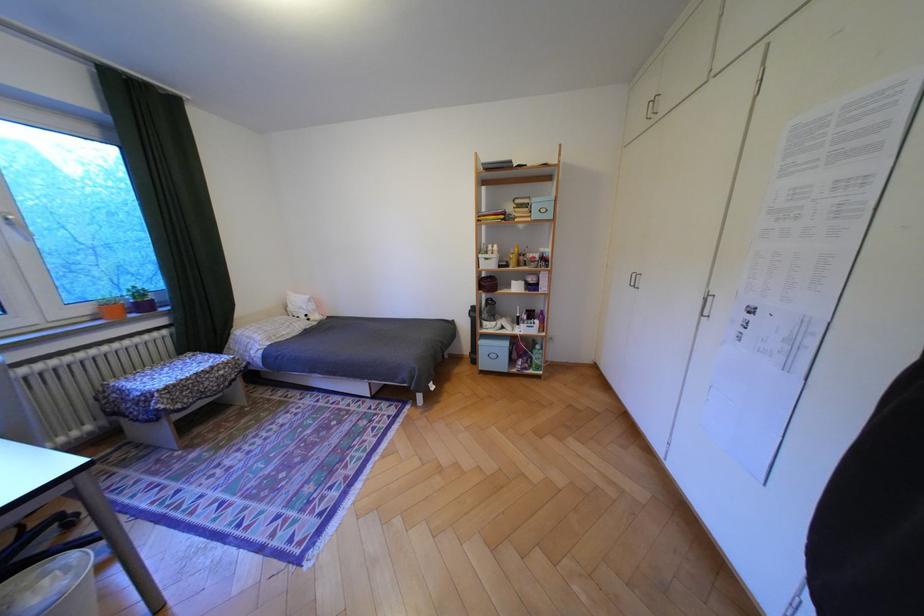
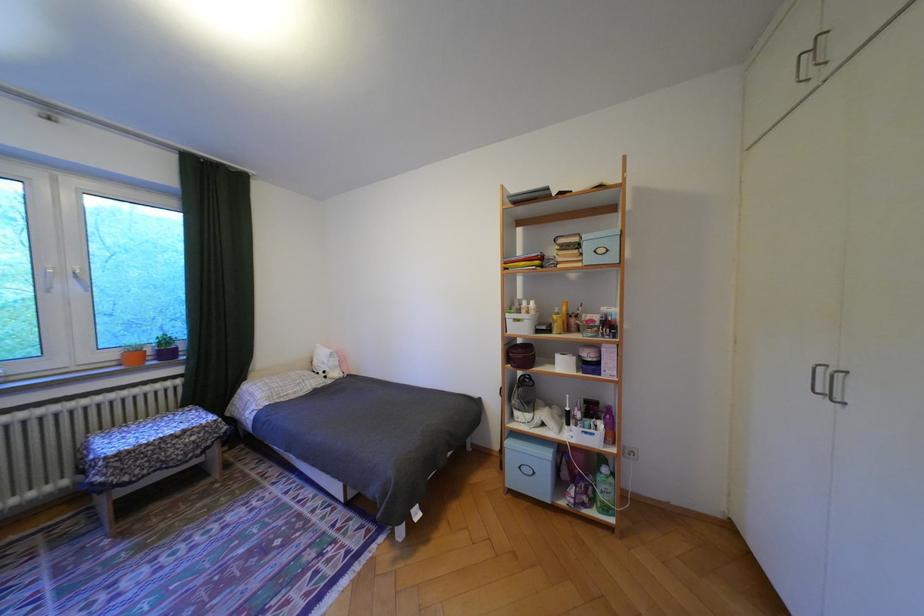
Locate, in the second image, the point that corresponds to point (155, 307) in the first image.

(178, 354)